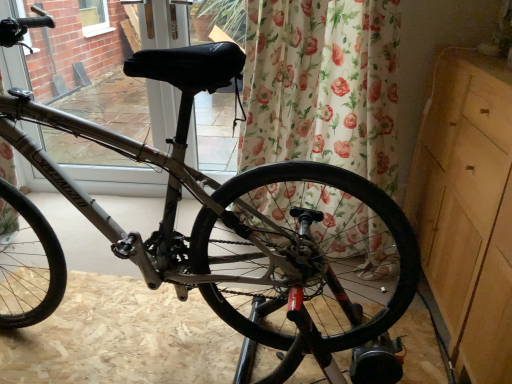
Question: Is black leather seat at upper center at the left side of floral fabric curtain at center?

Choices:
 (A) yes
 (B) no

Answer: (A)

Question: From a real-world perspective, does black leather seat at upper center stand above floral fabric curtain at center?

Choices:
 (A) no
 (B) yes

Answer: (B)

Question: Considering the relative sizes of black leather seat at upper center and floral fabric curtain at center in the image provided, is black leather seat at upper center thinner than floral fabric curtain at center?

Choices:
 (A) no
 (B) yes

Answer: (B)

Question: Does black leather seat at upper center lie behind floral fabric curtain at center?

Choices:
 (A) yes
 (B) no

Answer: (A)

Question: Is black leather seat at upper center next to floral fabric curtain at center?

Choices:
 (A) no
 (B) yes

Answer: (A)

Question: Based on their sizes in the image, would you say floral fabric curtain at center is bigger or smaller than black rubber tire at center?

Choices:
 (A) small
 (B) big

Answer: (B)

Question: From a real-world perspective, is floral fabric curtain at center positioned above or below black rubber tire at center?

Choices:
 (A) above
 (B) below

Answer: (A)

Question: From the image's perspective, is floral fabric curtain at center positioned above or below black rubber tire at center?

Choices:
 (A) above
 (B) below

Answer: (A)

Question: Would you say floral fabric curtain at center is inside or outside black rubber tire at center?

Choices:
 (A) outside
 (B) inside

Answer: (A)

Question: Looking at the image, does light wood dresser at right seem bigger or smaller compared to black rubber tire at center?

Choices:
 (A) big
 (B) small

Answer: (A)

Question: Is light wood dresser at right taller or shorter than black rubber tire at center?

Choices:
 (A) tall
 (B) short

Answer: (A)

Question: In terms of width, does light wood dresser at right look wider or thinner when compared to black rubber tire at center?

Choices:
 (A) thin
 (B) wide

Answer: (A)

Question: Is light wood dresser at right in front of or behind black rubber tire at center in the image?

Choices:
 (A) front
 (B) behind

Answer: (A)

Question: Would you say light wood dresser at right is inside or outside black leather seat at upper center?

Choices:
 (A) inside
 (B) outside

Answer: (B)

Question: Is point (509, 342) positioned closer to the camera than point (22, 175)?

Choices:
 (A) closer
 (B) farther

Answer: (A)